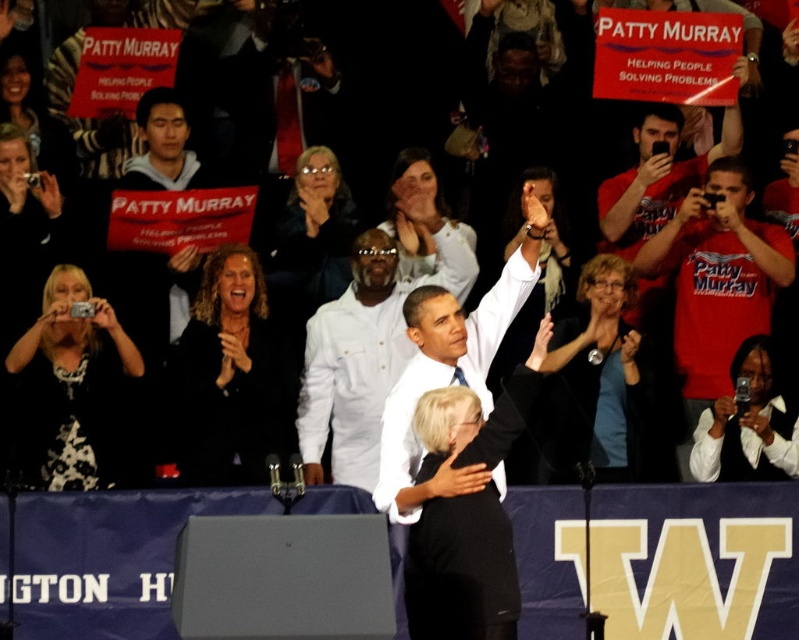
Which is in front, point (690, 355) or point (428, 196)?

Point (690, 355) is more forward.

Locate an element on the screen. red cotton t-shirt at upper right is located at coordinates (718, 278).

Find the location of a particular element. red cotton t-shirt at upper right is located at coordinates (718, 278).

Does red cotton t-shirt at upper right come in front of white fabric at upper center?

No, red cotton t-shirt at upper right is further to the viewer.

How much distance is there between red cotton t-shirt at upper right and white fabric at upper center?

They are 5.25 meters apart.

Identify the location of red cotton t-shirt at upper right. (718, 278).

Locate an element on the screen. red cotton t-shirt at upper right is located at coordinates (718, 278).

Is point (380, 241) in front of point (407, 186)?

Yes, point (380, 241) is closer to viewer.

Between white cotton shirt at center and smooth white blouse at center, which one appears on the right side from the viewer's perspective?

smooth white blouse at center

This screenshot has height=640, width=799. What are the coordinates of `white cotton shirt at center` in the screenshot? It's located at [364, 355].